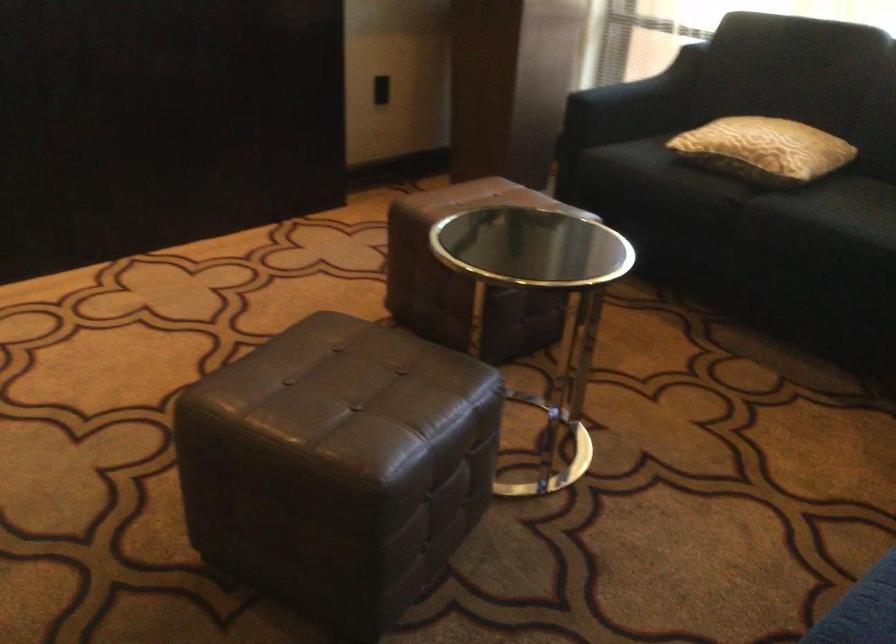
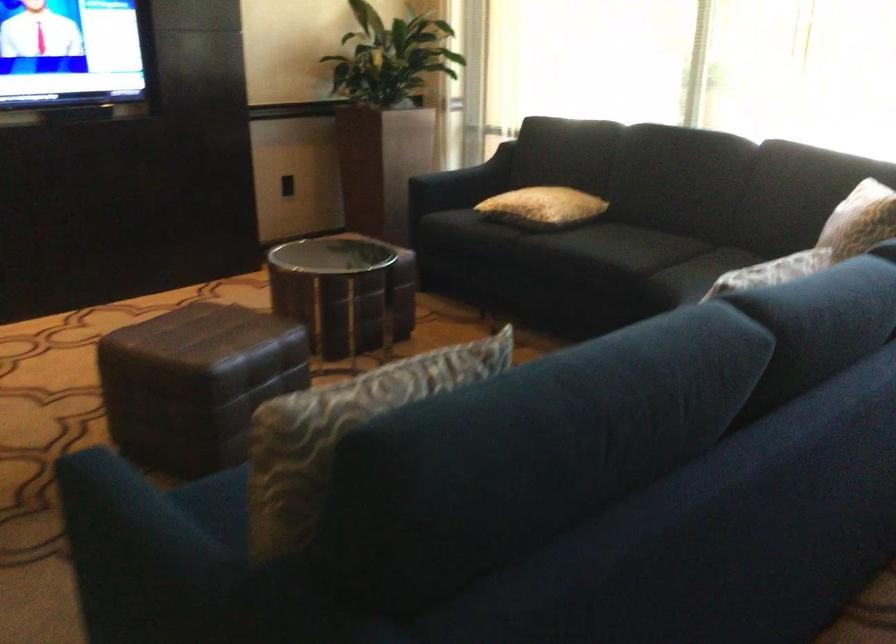
The point at (778, 152) is marked in the first image. Where is the corresponding point in the second image?

(543, 207)